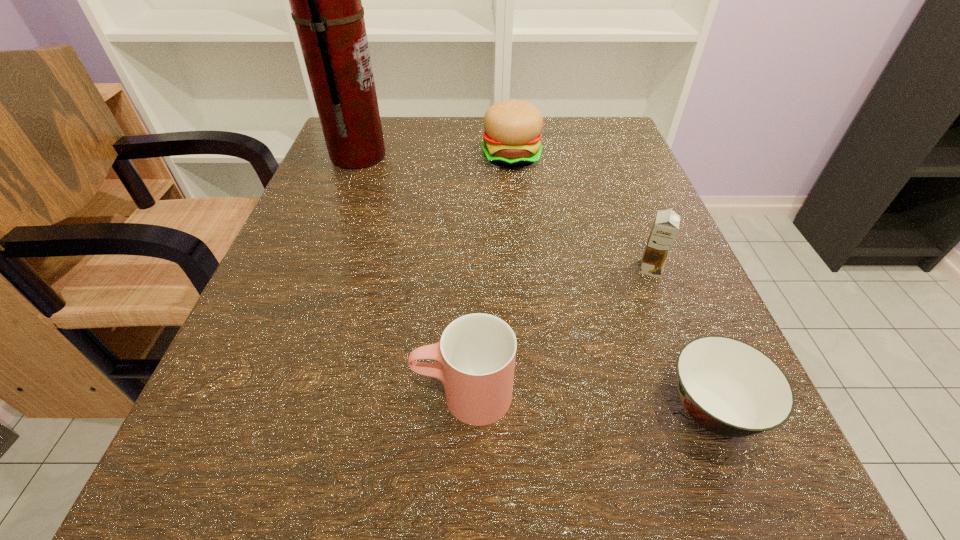
This screenshot has height=540, width=960. What are the coordinates of `blank area located on the side of the cup with the handle` in the screenshot? It's located at (331, 395).

Find the location of `free location located 0.230m on the side of the cup with the handle`. free location located 0.230m on the side of the cup with the handle is located at coordinates pyautogui.click(x=223, y=395).

What are the coordinates of `free location located on the back of the shortest object` in the screenshot? It's located at click(623, 188).

Find the location of a particular element. The height and width of the screenshot is (540, 960). fire extinguisher at the far edge is located at coordinates (325, 0).

Find the location of a particular element. hamburger positioned at the far edge is located at coordinates (512, 138).

The image size is (960, 540). I want to click on object located in the near edge section of the desktop, so click(x=730, y=388).

Locate an element on the screen. This screenshot has width=960, height=540. object situated at the left edge is located at coordinates (325, 0).

I want to click on chocolate milk located in the right edge section of the desktop, so click(x=666, y=225).

Image resolution: width=960 pixels, height=540 pixels. In order to click on soup bowl present at the right edge in this screenshot , I will do `click(730, 388)`.

Where is `object that is at the far left corner`? object that is at the far left corner is located at coordinates (325, 0).